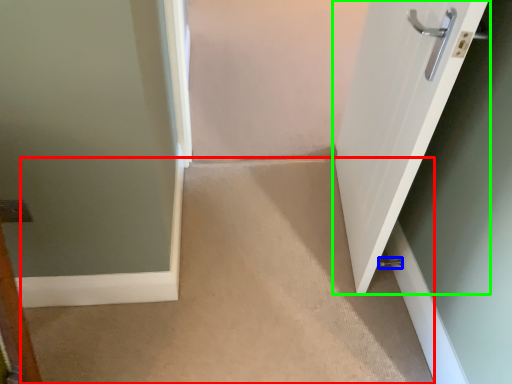
Question: Which object is the closest to the corridor (highlighted by a red box)? Choose among these: door handle (highlighted by a blue box) or door (highlighted by a green box).

Choices:
 (A) door handle
 (B) door

Answer: (B)